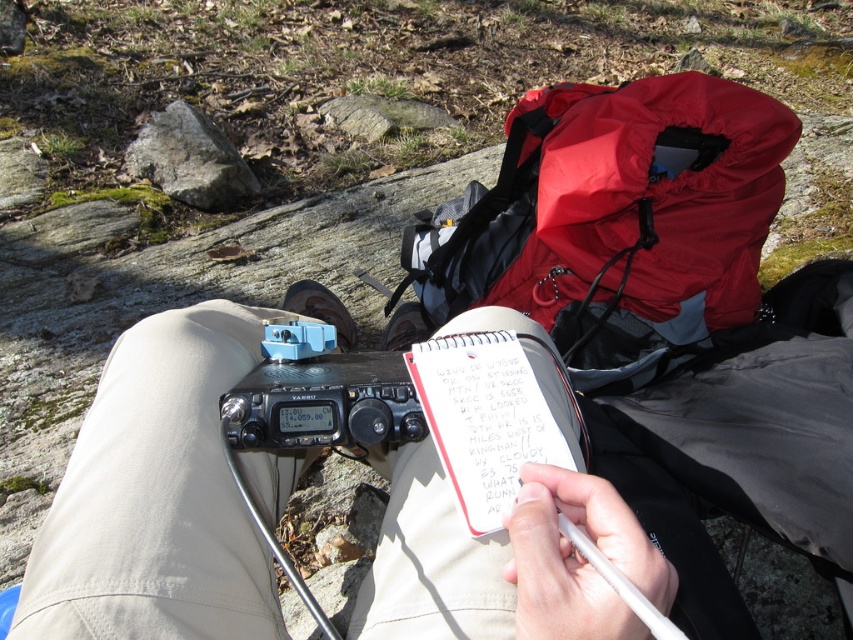
Which of these two, waterproof nylon backpack at upper right or black plastic radio at center, stands shorter?

black plastic radio at center

Does point (547, 157) come farther from viewer compared to point (233, 388)?

Yes, point (547, 157) is farther from viewer.

Find the location of `waterproof nylon backpack at upper right`. waterproof nylon backpack at upper right is located at coordinates (614, 221).

Between point (163, 413) and point (517, 172), which one is positioned behind?

The point (517, 172) is behind.

Is point (393, 595) behind point (480, 289)?

No, (393, 595) is closer to viewer.

Image resolution: width=853 pixels, height=640 pixels. Describe the element at coordinates (155, 497) in the screenshot. I see `black matte radio at center` at that location.

The height and width of the screenshot is (640, 853). I want to click on black matte radio at center, so (x=155, y=497).

Can you confirm if white paper notepad at center is positioned below black plastic radio at center?

Indeed, white paper notepad at center is positioned under black plastic radio at center.

Does point (445, 433) come farther from viewer compared to point (352, 401)?

No.

Where is `white paper notepad at center`? white paper notepad at center is located at coordinates (494, 417).